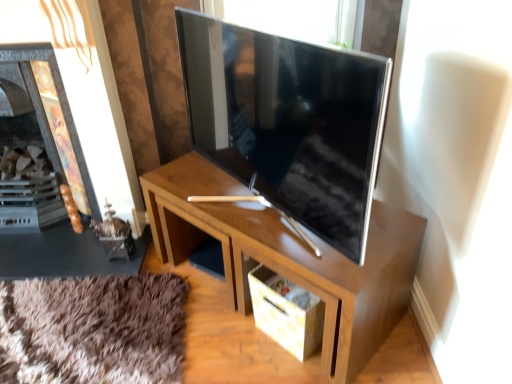
Question: Considering the relative positions of wooden fireplace at left and satin silver tv at center in the image provided, is wooden fireplace at left to the right of satin silver tv at center from the viewer's perspective?

Choices:
 (A) no
 (B) yes

Answer: (A)

Question: Can you confirm if wooden fireplace at left is thinner than satin silver tv at center?

Choices:
 (A) yes
 (B) no

Answer: (B)

Question: Is wooden fireplace at left oriented towards satin silver tv at center?

Choices:
 (A) no
 (B) yes

Answer: (A)

Question: From the image's perspective, is wooden fireplace at left located above satin silver tv at center?

Choices:
 (A) no
 (B) yes

Answer: (B)

Question: From a real-world perspective, is wooden fireplace at left located higher than satin silver tv at center?

Choices:
 (A) yes
 (B) no

Answer: (B)

Question: From the image's perspective, is wooden fireplace at left positioned above or below satin silver tv at center?

Choices:
 (A) above
 (B) below

Answer: (A)

Question: Is wooden fireplace at left inside or outside of satin silver tv at center?

Choices:
 (A) outside
 (B) inside

Answer: (A)

Question: From a real-world perspective, is wooden fireplace at left physically located above or below satin silver tv at center?

Choices:
 (A) below
 (B) above

Answer: (A)

Question: Based on their positions, is wooden fireplace at left located to the left or right of satin silver tv at center?

Choices:
 (A) right
 (B) left

Answer: (B)

Question: From a real-world perspective, is satin silver tv at center physically located above or below wooden fireplace at left?

Choices:
 (A) above
 (B) below

Answer: (A)

Question: Would you say satin silver tv at center is to the left or to the right of wooden fireplace at left in the picture?

Choices:
 (A) right
 (B) left

Answer: (A)

Question: Is satin silver tv at center taller or shorter than wooden fireplace at left?

Choices:
 (A) short
 (B) tall

Answer: (A)

Question: In the image, is satin silver tv at center positioned in front of or behind wooden fireplace at left?

Choices:
 (A) behind
 (B) front

Answer: (B)

Question: Is matte cardboard drawer at lower center in front of or behind satin silver tv at center in the image?

Choices:
 (A) behind
 (B) front

Answer: (A)

Question: From the image's perspective, is matte cardboard drawer at lower center positioned above or below satin silver tv at center?

Choices:
 (A) below
 (B) above

Answer: (A)